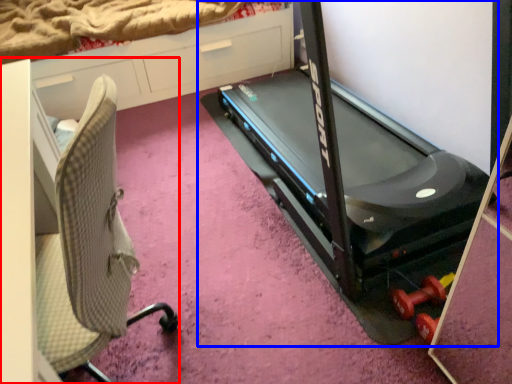
Question: Among these objects, which one is nearest to the camera, furniture (highlighted by a red box) or treadmill (highlighted by a blue box)?

Choices:
 (A) furniture
 (B) treadmill

Answer: (A)